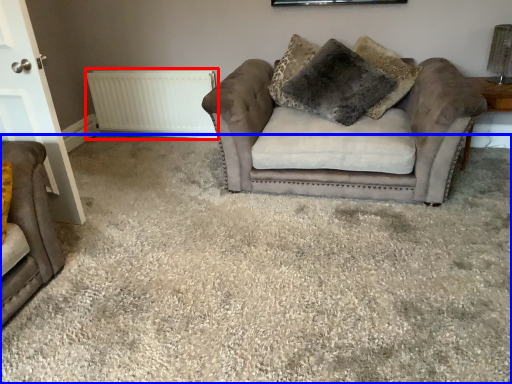
Question: Which object is further to the camera taking this photo, radiator (highlighted by a red box) or plain (highlighted by a blue box)?

Choices:
 (A) radiator
 (B) plain

Answer: (A)